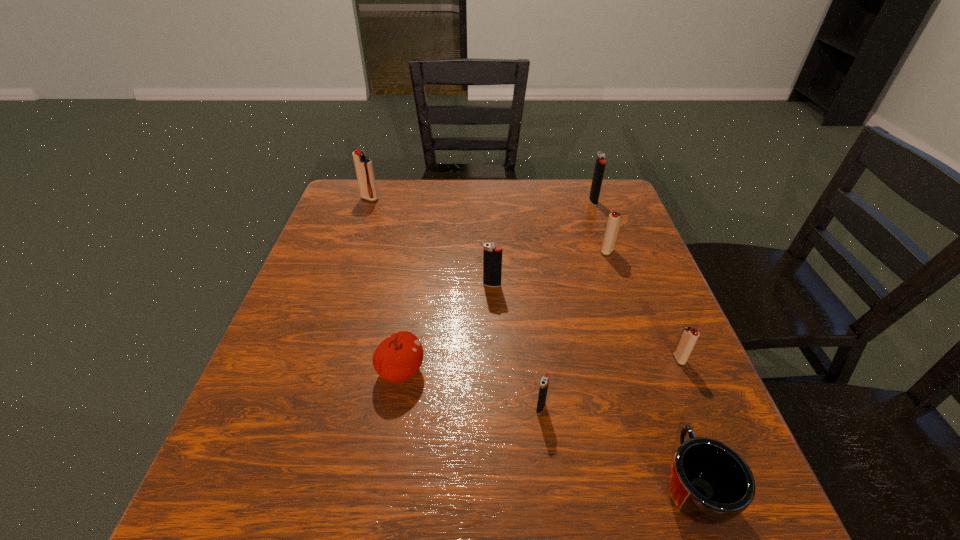
At what (x,y) coordinates should I click in order to perform the action: click on the leftmost object. Please return your answer as a coordinate pair (x, y). The image size is (960, 540). Looking at the image, I should click on (364, 169).

At what (x,y) coordinates should I click in order to perform the action: click on the leftmost igniter. Please return your answer as a coordinate pair (x, y). The width and height of the screenshot is (960, 540). Looking at the image, I should click on (364, 169).

The height and width of the screenshot is (540, 960). What are the coordinates of `the farthest black igniter` in the screenshot? It's located at (600, 163).

I want to click on the rightmost black igniter, so click(600, 163).

Image resolution: width=960 pixels, height=540 pixels. In order to click on the fourth farthest igniter in this screenshot , I will do `click(492, 255)`.

Where is `the second igniter from left to right`? This screenshot has height=540, width=960. the second igniter from left to right is located at coordinates (492, 255).

This screenshot has height=540, width=960. I want to click on the second red igniter from left to right, so (614, 221).

Where is `the third farthest object`? The image size is (960, 540). the third farthest object is located at coordinates (614, 221).

Where is `red apple`? Image resolution: width=960 pixels, height=540 pixels. red apple is located at coordinates (397, 358).

Locate an element on the screen. Image resolution: width=960 pixels, height=540 pixels. the seventh object from right to left is located at coordinates (397, 358).